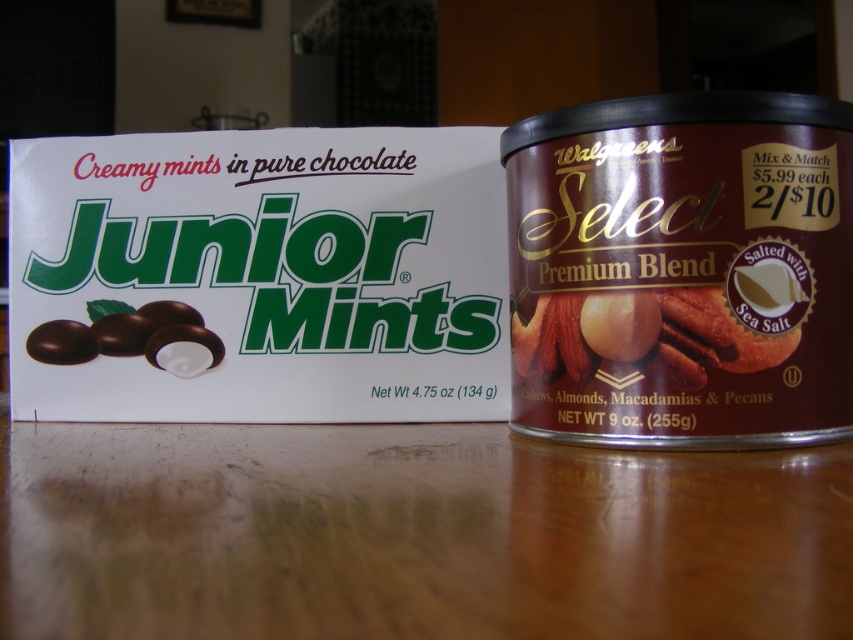
Question: Which object appears farthest from the camera in this image?

Choices:
 (A) chocolate matte junior mints at left
 (B) matte chocolate mints at left

Answer: (B)

Question: Observing the image, what is the correct spatial positioning of chocolate matte junior mints at left in reference to matte chocolate mints at left?

Choices:
 (A) below
 (B) above

Answer: (B)

Question: Which object appears farthest from the camera in this image?

Choices:
 (A) brown glossy nuts at center
 (B) chocolate matte junior mints at left
 (C) matte chocolate mints at left

Answer: (C)

Question: Can you confirm if brown glossy nuts at center is wider than chocolate matte junior mints at left?

Choices:
 (A) no
 (B) yes

Answer: (A)

Question: Does brown glossy nuts at center appear on the left side of matte chocolate mints at left?

Choices:
 (A) no
 (B) yes

Answer: (A)

Question: Which point is closer to the camera?

Choices:
 (A) matte chocolate mints at left
 (B) chocolate matte junior mints at left

Answer: (B)